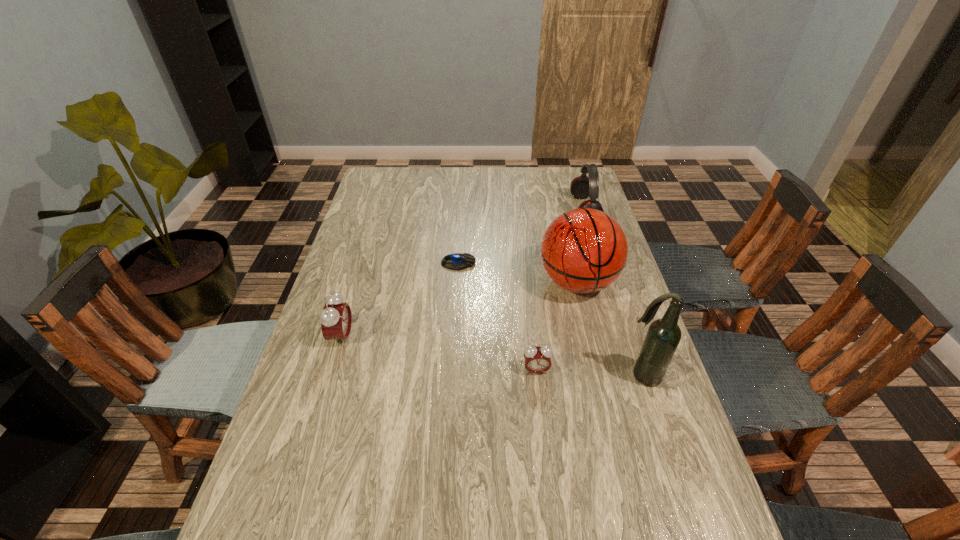
Image resolution: width=960 pixels, height=540 pixels. In order to click on free space that satisfies the following two spatial constraints: 1. on the ear cups of the farthest object; 2. on the side with spill of the basketball in this screenshot , I will do `click(607, 282)`.

Locate an element on the screen. This screenshot has height=540, width=960. free space in the image that satisfies the following two spatial constraints: 1. on the clock face of the beer bottle; 2. on the left side of the third shortest object is located at coordinates (330, 376).

Where is `vacant space that satisfies the following two spatial constraints: 1. on the side with spill of the basketball; 2. on the clock face of the farther alarm clock`? The height and width of the screenshot is (540, 960). vacant space that satisfies the following two spatial constraints: 1. on the side with spill of the basketball; 2. on the clock face of the farther alarm clock is located at coordinates (590, 337).

Locate an element on the screen. vacant area in the image that satisfies the following two spatial constraints: 1. on the back side of the beer bottle; 2. on the clock face of the taller alarm clock is located at coordinates (630, 337).